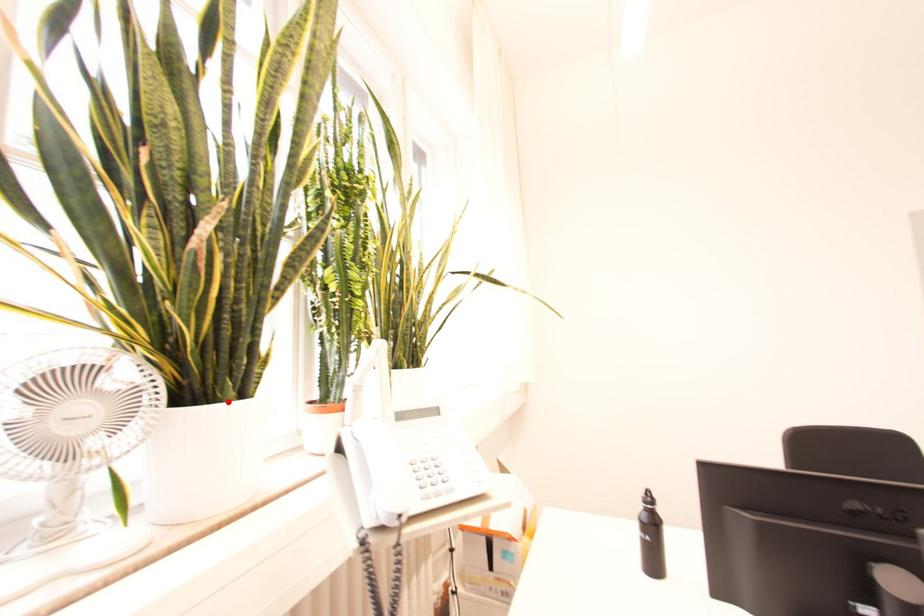
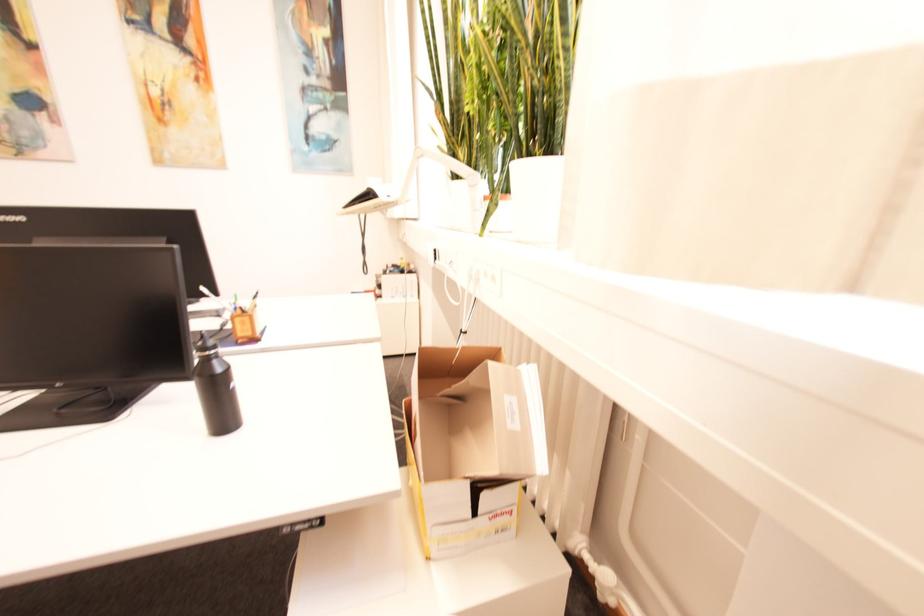
Question: I am providing you with two images of the same scene from different viewpoints. A red point is marked on the first image. Is the red point's position out of view in image 2?

Choices:
 (A) Yes
 (B) No

Answer: (A)